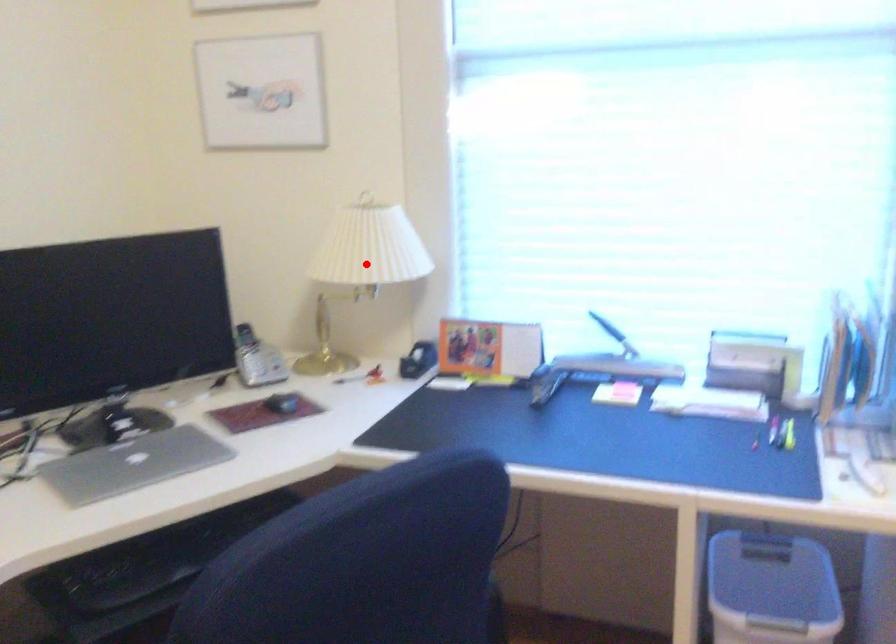
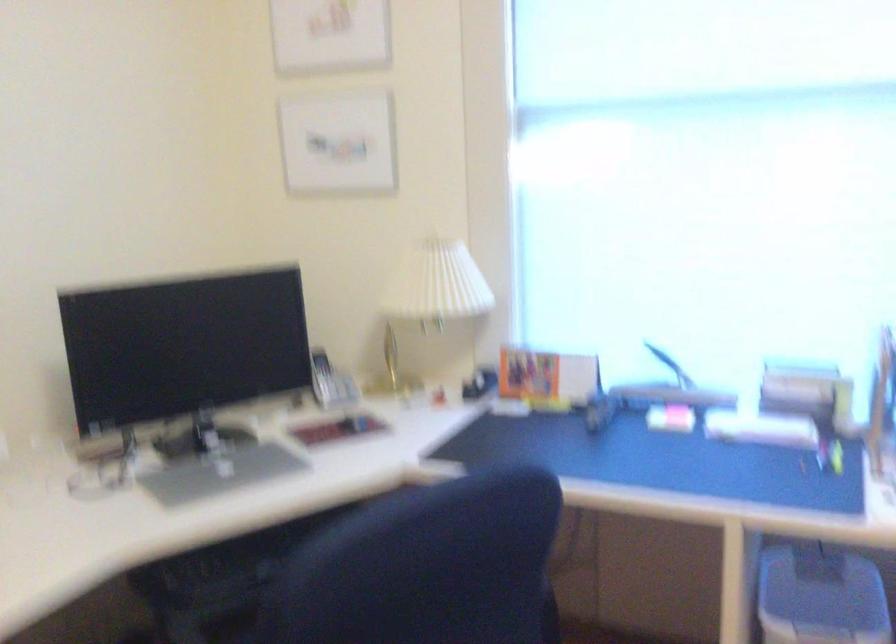
Find the pixel in the second image that matches the highlighted location in the first image.

(433, 295)